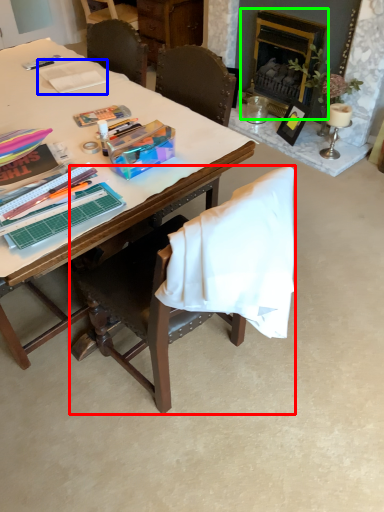
Question: Which object is positioned farthest from chair (highlighted by a red box)? Select from paperback book (highlighted by a blue box) and fireplace (highlighted by a green box).

Choices:
 (A) paperback book
 (B) fireplace

Answer: (B)